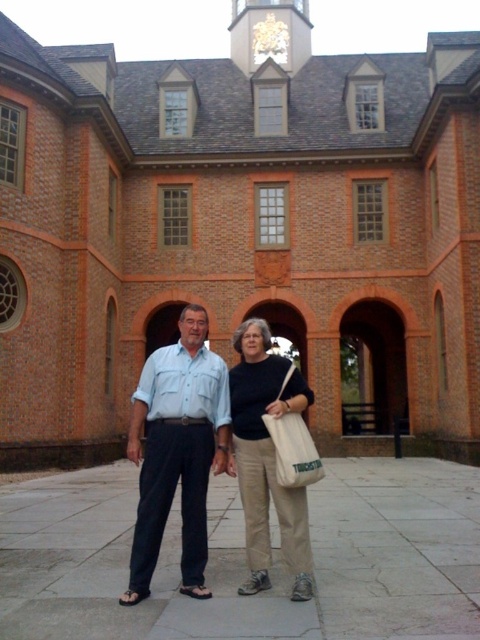
Question: Can you confirm if light blue denim shirt at center is positioned to the right of beige cotton pants at center?

Choices:
 (A) yes
 (B) no

Answer: (B)

Question: Is the position of light blue denim shirt at center less distant than that of beige cotton pants at center?

Choices:
 (A) yes
 (B) no

Answer: (A)

Question: Is light blue denim shirt at center further to camera compared to white canvas bag at center?

Choices:
 (A) yes
 (B) no

Answer: (B)

Question: Which object is the farthest from the light blue denim shirt at center?

Choices:
 (A) white canvas bag at center
 (B) beige cotton pants at center

Answer: (A)

Question: Which point is farther to the camera?

Choices:
 (A) (241, 416)
 (B) (212, 352)

Answer: (B)

Question: Which point is closer to the camera taking this photo?

Choices:
 (A) (302, 444)
 (B) (303, 568)

Answer: (B)